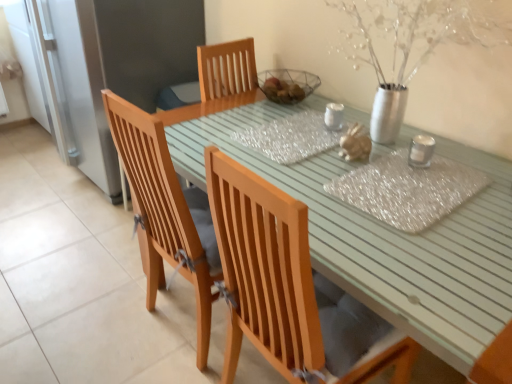
The image size is (512, 384). In order to click on vacant area that lies between translucent glass jar at center and clear plastic placemat at center in this screenshot , I will do `click(360, 164)`.